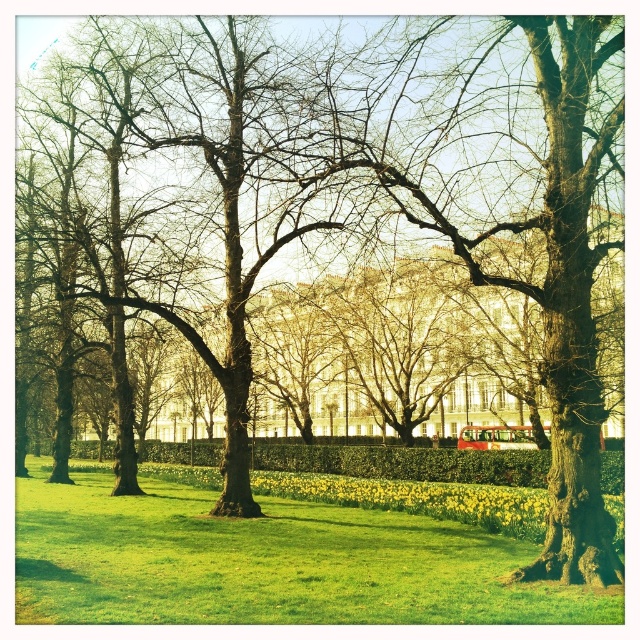
You are planning to set up a picnic in the park. You have a picnic blanket that can cover an area of 2 square meters. You see the green grassy at center and the green leafy hedge at center. Which area would be more suitable for placing your picnic blanket, considering the space they occupy?

The green grassy at center occupies less space than the green leafy hedge at center. Therefore, the green leafy hedge at center has a larger area and would be more suitable for placing the picnic blanket since it can accommodate the 2 square meter blanket.

You are a gardener planning to plant new flowers in the park. You see the green grassy at center and the green leafy hedge at center. Which one is located above the other?

The green grassy at center is positioned over the green leafy hedge at center.

You are standing in the park and see a point marked at coordinates (266, 563). According to the scene description, what is the object located at that point?

The point at coordinates (266, 563) indicates green grassy at center, so the object located there is green grassy at center.